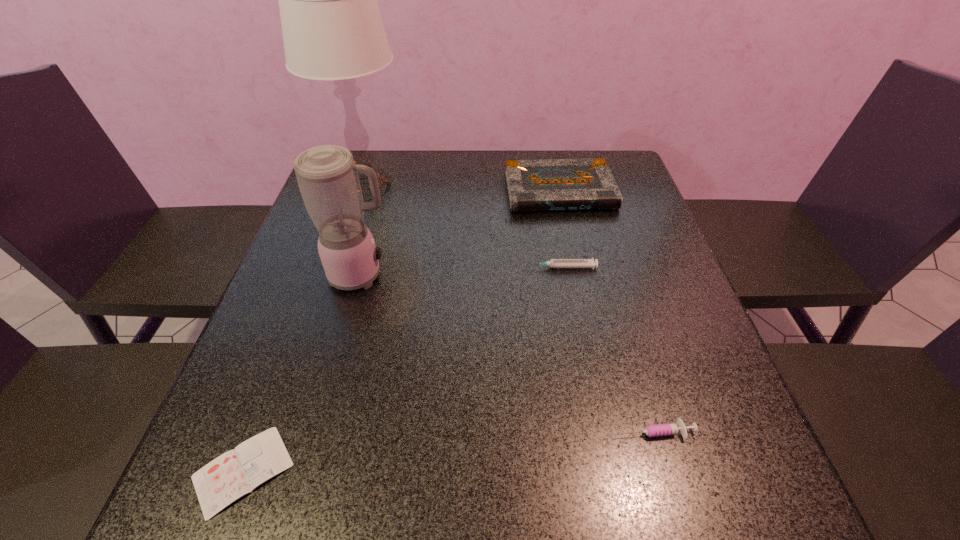
The image size is (960, 540). I want to click on object that ranks as the fourth closest to the food processor, so click(559, 184).

Select which object is the fourth closest to the nearer syringe. Please provide its 2D coordinates. Your answer should be formatted as a tuple, i.e. [(x, y)], where the tuple contains the x and y coordinates of a point satisfying the conditions above.

[(559, 184)]

This screenshot has height=540, width=960. I want to click on blank space that satisfies the following two spatial constraints: 1. on the front-facing side of the nearer syringe; 2. on the left side of the tallest object, so click(290, 431).

You are a GUI agent. You are given a task and a screenshot of the screen. Output one action in this format:
    pyautogui.click(x=<x>, y=<y>)
    Task: Click on the free space that satisfies the following two spatial constraints: 1. on the front side of the notebook; 2. at the needle end of the farther syringe
    
    Given the screenshot: What is the action you would take?
    pyautogui.click(x=576, y=267)

This screenshot has height=540, width=960. In order to click on vacant space that satisfies the following two spatial constraints: 1. on the front-facing side of the table lamp; 2. on the front side of the diary in this screenshot , I will do `click(277, 471)`.

The width and height of the screenshot is (960, 540). I want to click on vacant space that satisfies the following two spatial constraints: 1. at the needle end of the farther syringe; 2. on the left side of the nearer syringe, so click(592, 431).

The width and height of the screenshot is (960, 540). I want to click on vacant region that satisfies the following two spatial constraints: 1. on the base of the nearer syringe near the control knob; 2. on the left side of the food processor, so click(x=319, y=431).

The width and height of the screenshot is (960, 540). Identify the location of free spot that satisfies the following two spatial constraints: 1. on the back side of the shortest object; 2. on the left side of the nearer syringe. (258, 431).

Identify the location of vacant space that satisfies the following two spatial constraints: 1. at the needle end of the farther syringe; 2. on the right side of the nearer syringe. The width and height of the screenshot is (960, 540). (592, 431).

You are a GUI agent. You are given a task and a screenshot of the screen. Output one action in this format:
    pyautogui.click(x=<x>, y=<y>)
    Task: Click on the vacant area in the image that satisfies the following two spatial constraints: 1. on the base of the food processor near the control knob; 2. on the left side of the nearer syringe
    This screenshot has height=540, width=960.
    Given the screenshot: What is the action you would take?
    [319, 431]